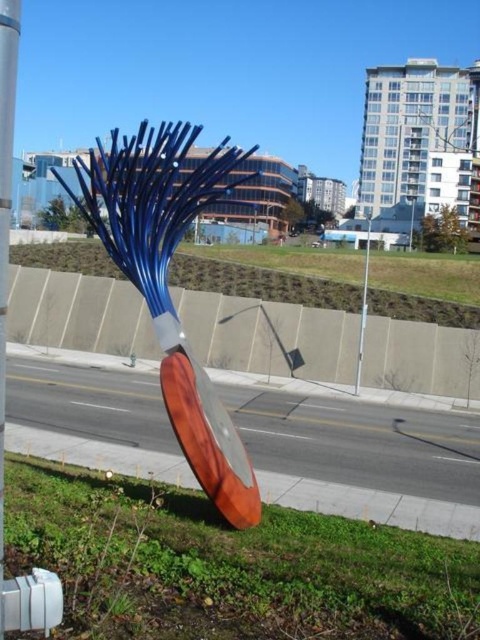
Question: Does green grass at center appear under smooth silver pole at center?

Choices:
 (A) yes
 (B) no

Answer: (B)

Question: Among these points, which one is farthest from the camera?

Choices:
 (A) (268, 296)
 (B) (0, 289)
 (C) (230, 449)
 (D) (358, 388)

Answer: (A)

Question: Which of the following is the closest to the observer?

Choices:
 (A) smooth silver pole at center
 (B) metallic silver pole at center
 (C) shiny blue metal sculpture at center
 (D) green grass at lower center

Answer: (A)

Question: Which point is closer to the camera?

Choices:
 (A) metallic silver pole at center
 (B) smooth silver pole at center

Answer: (B)

Question: Is shiny blue metal sculpture at center positioned behind metallic silver pole at center?

Choices:
 (A) no
 (B) yes

Answer: (A)

Question: Does green grass at lower center have a larger size compared to green grass at center?

Choices:
 (A) yes
 (B) no

Answer: (B)